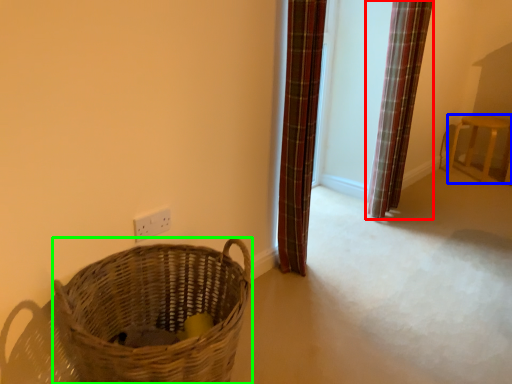
Question: Estimate the real-world distances between objects in this image. Which object is farther from curtain (highlighted by a red box), furniture (highlighted by a blue box) or basket (highlighted by a green box)?

Choices:
 (A) furniture
 (B) basket

Answer: (B)